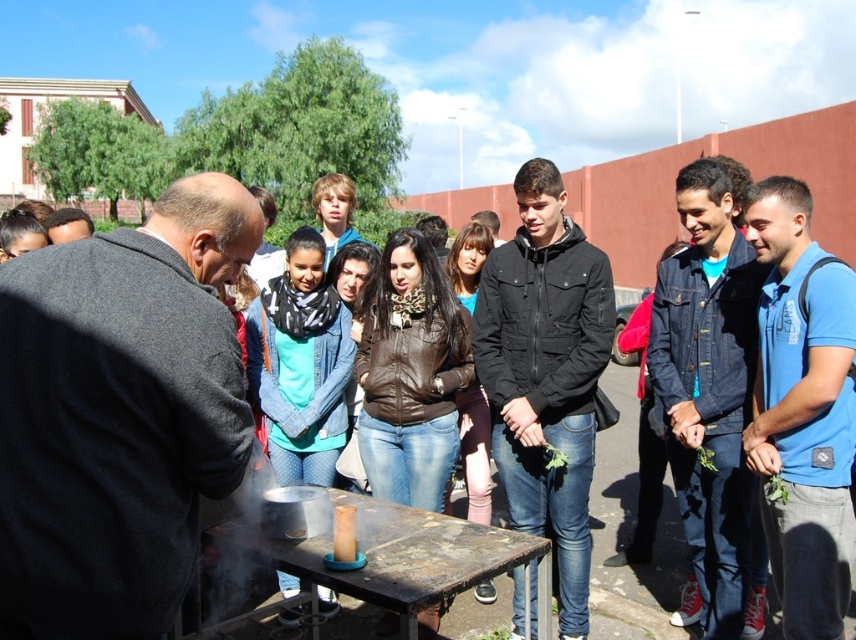
You are a guest at this event and want to place a small book between the brown leather jacket at center and the translucent glass jar at center on the table. Can you fit it there?

The brown leather jacket at center is taller than the translucent glass jar at center, so there might be enough space between them to place a small book.

You are standing at the edge of the table and want to place a new item on the table. Where should you put it so it doesn not interfere with the black leather jacket at center?

Place the new item away from the coordinates point (545, 372) where the black leather jacket at center is located to avoid interference.